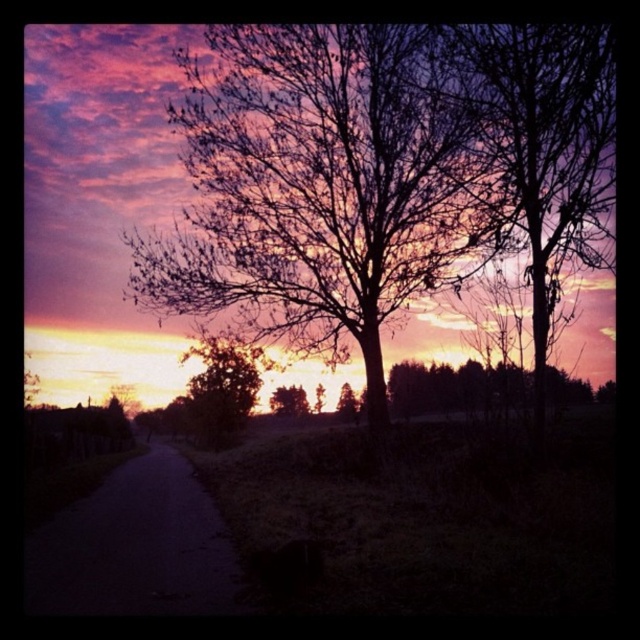
Does bare branches at right have a greater height compared to green matte tree at center?

Indeed, bare branches at right has a greater height compared to green matte tree at center.

Which is behind, point (544, 401) or point (308, 410)?

The point (308, 410) is more distant.

The height and width of the screenshot is (640, 640). I want to click on bare branches at right, so click(541, 145).

Between dark asphalt road at lower left and green matte tree at center, which one has less height?

Standing shorter between the two is green matte tree at center.

Does dark asphalt road at lower left have a greater width compared to green matte tree at center?

Yes, dark asphalt road at lower left is wider than green matte tree at center.

Which is in front, point (132, 552) or point (272, 404)?

Positioned in front is point (132, 552).

Identify the location of dark asphalt road at lower left. The height and width of the screenshot is (640, 640). (134, 547).

Who is higher up, silhouette leafless tree at center or dark asphalt road at lower left?

silhouette leafless tree at center is higher up.

Where is `silhouette leafless tree at center`? The width and height of the screenshot is (640, 640). silhouette leafless tree at center is located at coordinates (323, 186).